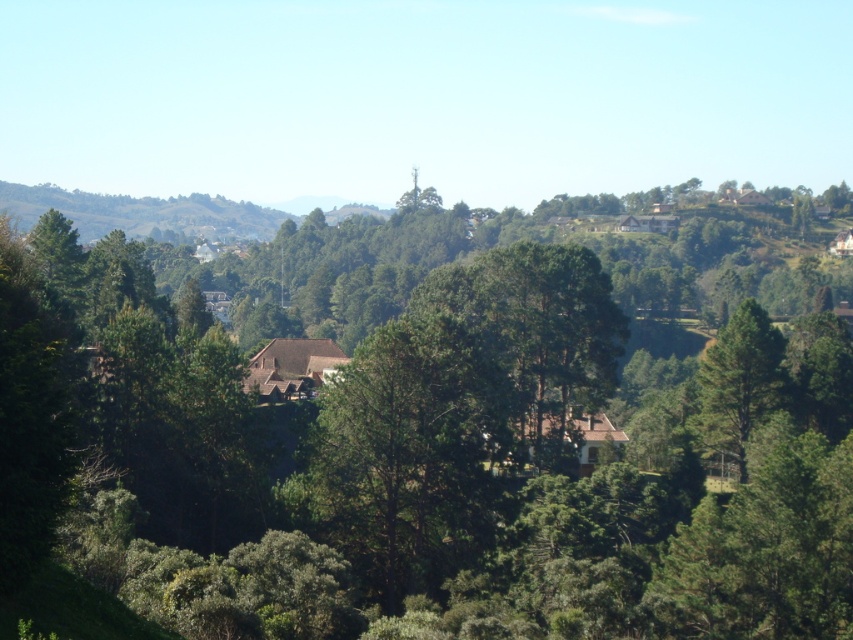
Can you confirm if green leafy tree at center is smaller than green matte tree at center?

No, green leafy tree at center is not smaller than green matte tree at center.

What do you see at coordinates (426, 435) in the screenshot?
I see `green leafy tree at center` at bounding box center [426, 435].

I want to click on green leafy tree at center, so click(x=426, y=435).

Between green leafy tree at center and green matte tree at right, which one has less height?

green matte tree at right

Image resolution: width=853 pixels, height=640 pixels. What are the coordinates of `green leafy tree at center` in the screenshot? It's located at (426, 435).

Can you confirm if green matte tree at center is taller than green matte tree at right?

Correct, green matte tree at center is much taller as green matte tree at right.

Which is behind, point (323, 531) or point (746, 356)?

Point (746, 356)

The width and height of the screenshot is (853, 640). I want to click on green matte tree at center, so click(x=404, y=456).